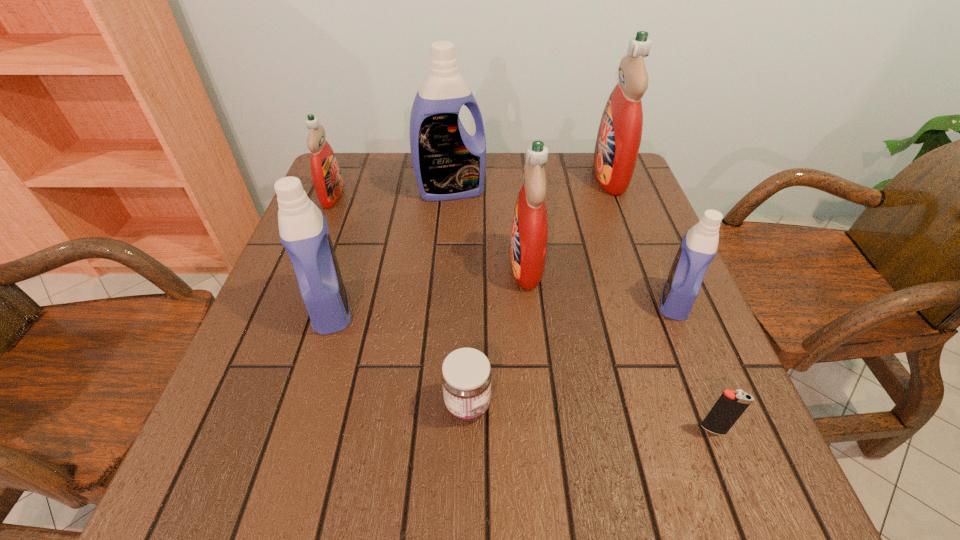
The height and width of the screenshot is (540, 960). I want to click on jam, so click(466, 376).

Where is `igniter`? igniter is located at coordinates (729, 407).

Locate an element on the screen. The image size is (960, 540). vacant space located 0.110m on the front surface of the rightmost red detergent is located at coordinates (554, 177).

The height and width of the screenshot is (540, 960). Find the location of `vacant region located on the front surface of the rightmost red detergent`. vacant region located on the front surface of the rightmost red detergent is located at coordinates (550, 177).

At what (x,y) coordinates should I click in order to perform the action: click on free space located on the front surface of the rightmost red detergent. Please return your answer as a coordinate pair (x, y). Image resolution: width=960 pixels, height=540 pixels. Looking at the image, I should click on (493, 177).

Locate an element on the screen. Image resolution: width=960 pixels, height=540 pixels. vacant space located on the right of the fourth detergent from right to left is located at coordinates (582, 191).

Find the location of a particular element. Image resolution: width=960 pixels, height=540 pixels. free space located on the front surface of the second smallest red detergent is located at coordinates (363, 265).

The width and height of the screenshot is (960, 540). I want to click on free space located on the front surface of the second smallest red detergent, so click(x=429, y=265).

The height and width of the screenshot is (540, 960). I want to click on vacant space located on the front surface of the second smallest red detergent, so click(340, 265).

The width and height of the screenshot is (960, 540). I want to click on vacant space located 0.270m on the right of the fifth detergent from right to left, so click(x=488, y=307).